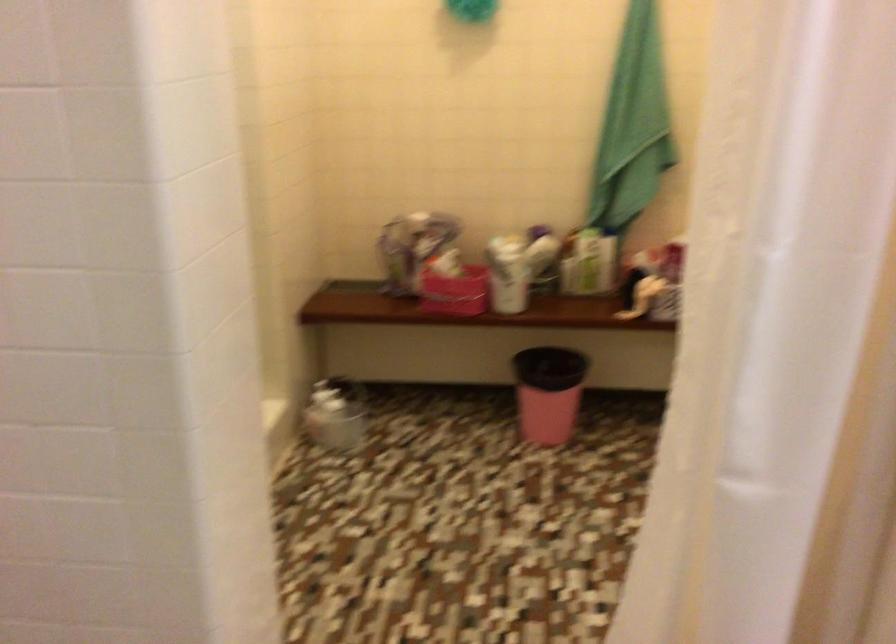
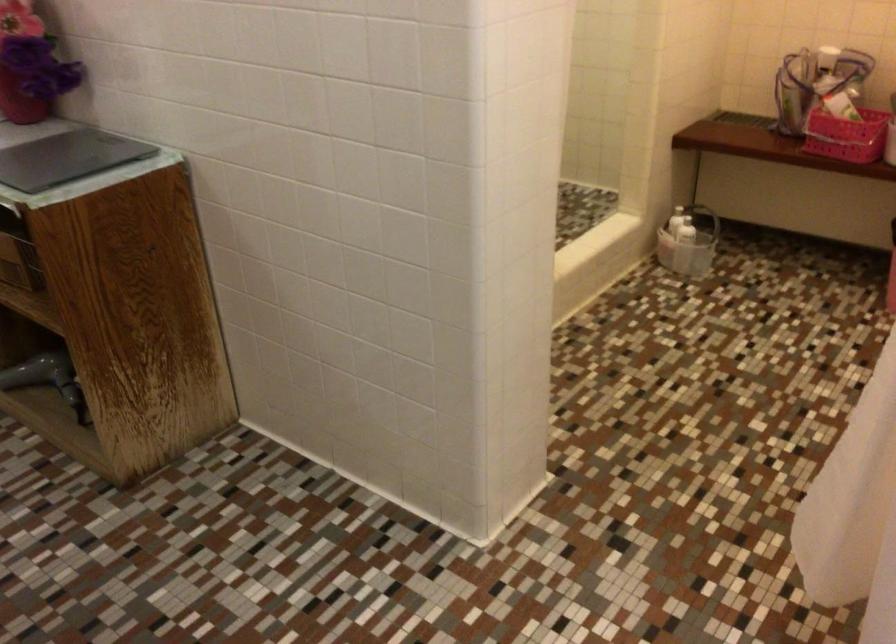
Where in the second image is the point corresponding to [457,306] from the first image?

(847, 136)